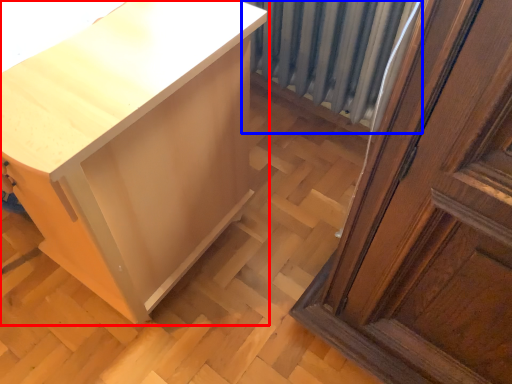
Question: Which point is further to the camera, furniture (highlighted by a red box) or radiator (highlighted by a blue box)?

Choices:
 (A) furniture
 (B) radiator

Answer: (B)